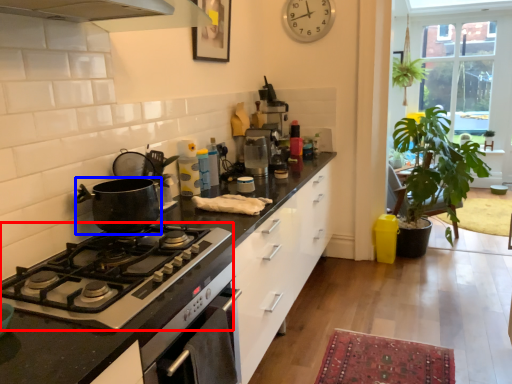
Question: Which point is closer to the camera, gas stove (highlighted by a red box) or kitchen appliance (highlighted by a blue box)?

Choices:
 (A) gas stove
 (B) kitchen appliance

Answer: (A)